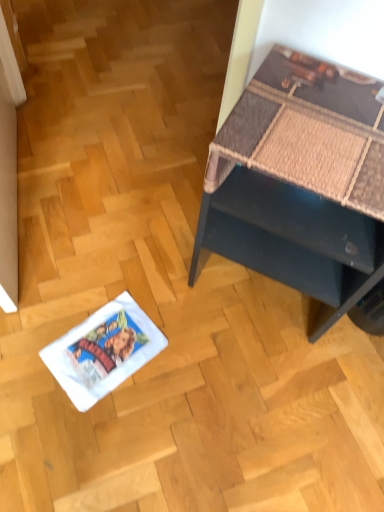
This screenshot has width=384, height=512. Identify the location of vacant space in between dark blue textured desk at upper right and white paper comic book at lower left. (204, 339).